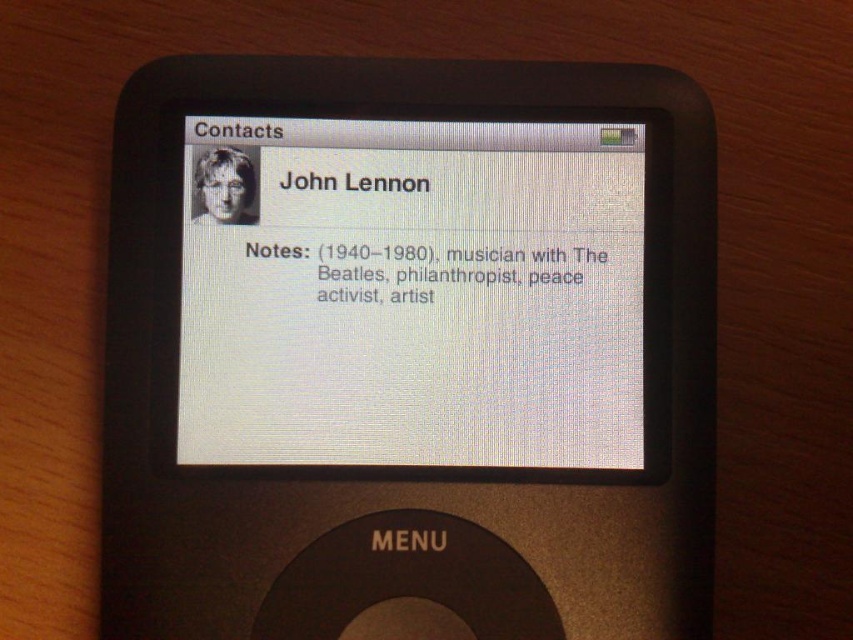
Does black plastic ipod at center lie in front of black matte text at center?

Yes, it is in front of black matte text at center.

In the scene shown: Between black plastic ipod at center and black matte text at center, which one appears on the right side from the viewer's perspective?

black matte text at center

Identify the location of black plastic ipod at center. (408, 353).

In order to click on black plastic ipod at center in this screenshot , I will do `click(408, 353)`.

Is white matte screen at center smaller than black matte text at center?

No, white matte screen at center is not smaller than black matte text at center.

Between point (363, 355) and point (332, 282), which one is positioned behind?

Point (332, 282)

Identify the location of white matte screen at center. The image size is (853, 640). (410, 292).

Image resolution: width=853 pixels, height=640 pixels. In order to click on white matte screen at center in this screenshot , I will do `click(410, 292)`.

Which is above, black plastic ipod at center or white matte text at center?

white matte text at center is higher up.

Who is more distant from viewer, (370,104) or (514,257)?

Positioned behind is point (514,257).

This screenshot has height=640, width=853. I want to click on black plastic ipod at center, so click(408, 353).